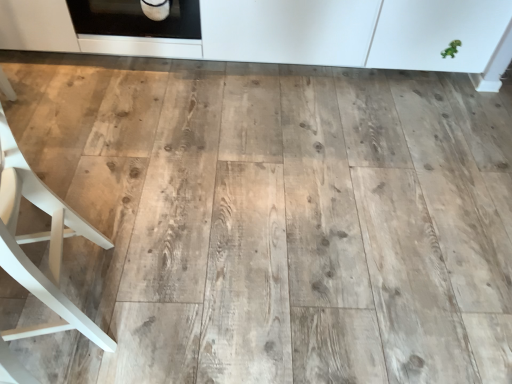
Find the location of a particular element. The image size is (512, 384). vacant location below white wood chair at left (from a real-world perspective) is located at coordinates (78, 291).